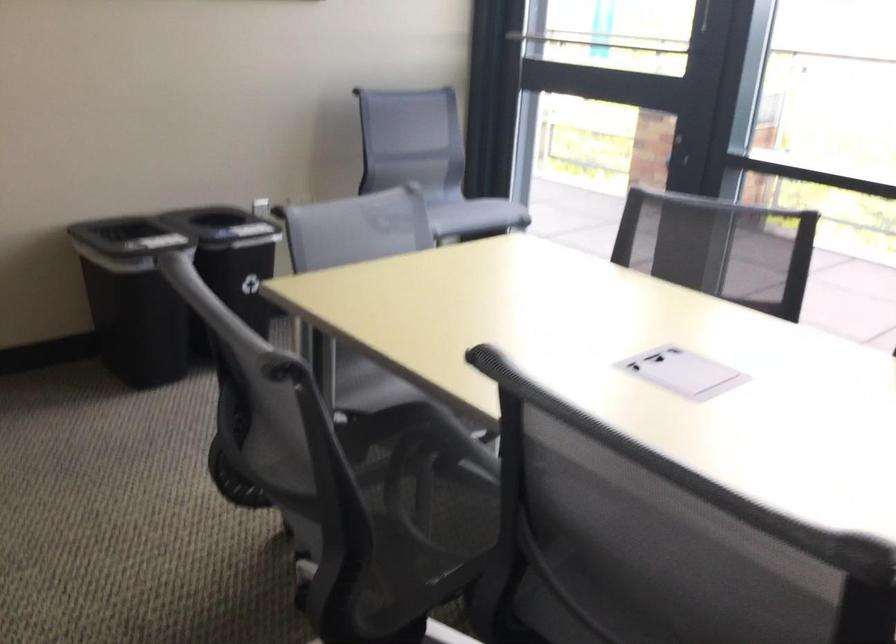
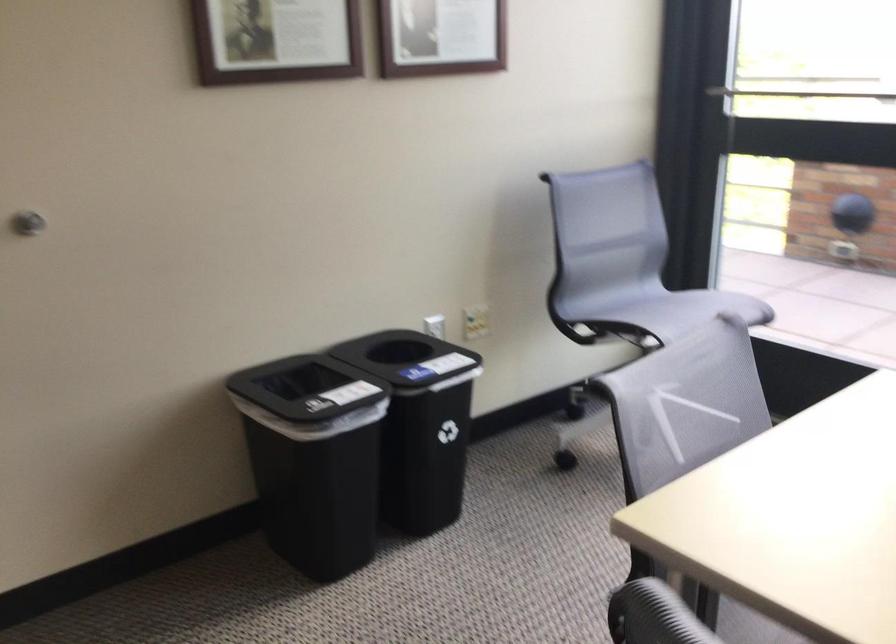
In a continuous first-person perspective shot, in which direction is the camera moving?

The cameraman moved toward left, forward.